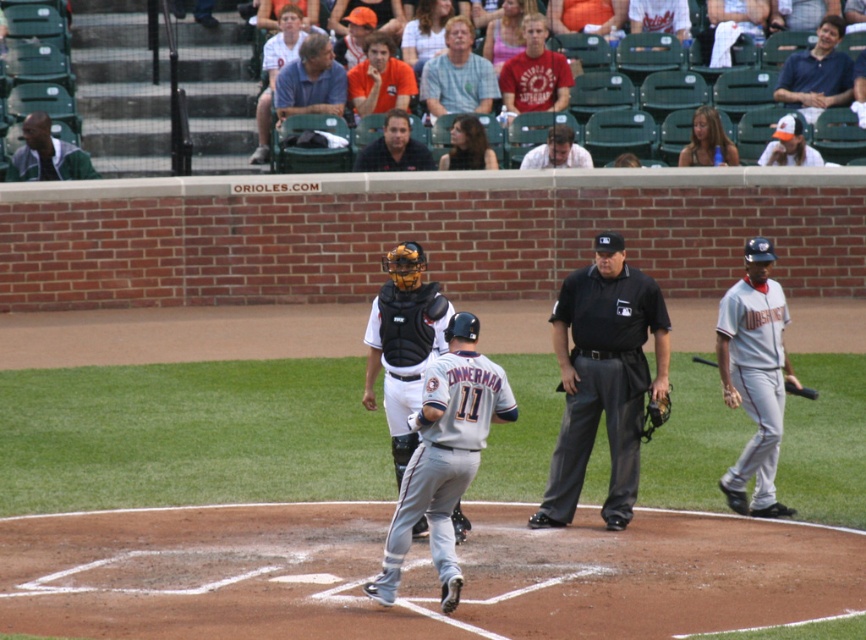
Is gray matte uniform at center to the right of orange shirt at upper center from the viewer's perspective?

Correct, you'll find gray matte uniform at center to the right of orange shirt at upper center.

This screenshot has width=866, height=640. Identify the location of gray matte uniform at center. (444, 456).

Between point (388, 545) and point (396, 148), which one is positioned behind?

The point (396, 148) is behind.

Between gray matte uniform at center and matte black helmet at upper center, which one appears on the right side from the viewer's perspective?

gray matte uniform at center is more to the right.

In order to click on gray matte uniform at center in this screenshot , I will do `click(444, 456)`.

Where is `gray matte uniform at center`? gray matte uniform at center is located at coordinates (444, 456).

Image resolution: width=866 pixels, height=640 pixels. Describe the element at coordinates (393, 147) in the screenshot. I see `matte black helmet at upper center` at that location.

Which of these two, matte black helmet at upper center or black leather baseball glove at center, stands taller?

matte black helmet at upper center is taller.

Is point (376, 148) in front of point (662, 403)?

No, it is behind (662, 403).

Locate an element on the screen. The height and width of the screenshot is (640, 866). matte black helmet at upper center is located at coordinates (393, 147).